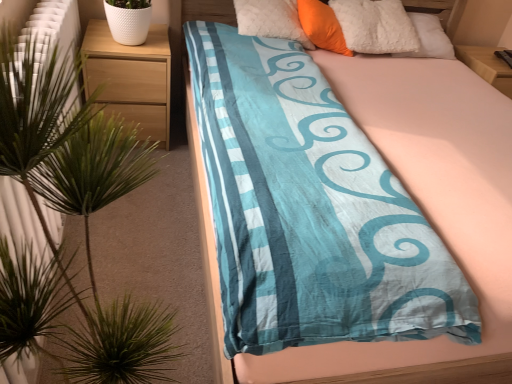
Question: From their relative heights in the image, would you say blue cotton bed at center is taller or shorter than green leafy plant at left?

Choices:
 (A) tall
 (B) short

Answer: (B)

Question: Considering the positions of point (490, 155) and point (150, 370), is point (490, 155) closer or farther from the camera than point (150, 370)?

Choices:
 (A) closer
 (B) farther

Answer: (B)

Question: Based on their relative distances, which object is nearer to the wooden nightstand at left?

Choices:
 (A) blue cotton bed at center
 (B) green leafy plant at left
 (C) orange soft pillow at upper center

Answer: (B)

Question: Estimate the real-world distances between objects in this image. Which object is closer to the green leafy plant at left?

Choices:
 (A) wooden nightstand at left
 (B) orange soft pillow at upper center
 (C) blue cotton bed at center

Answer: (A)